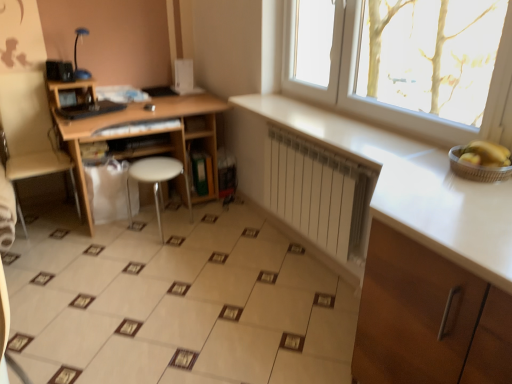
Identify the location of vacant area that is in front of metallic silver basket at right. (481, 195).